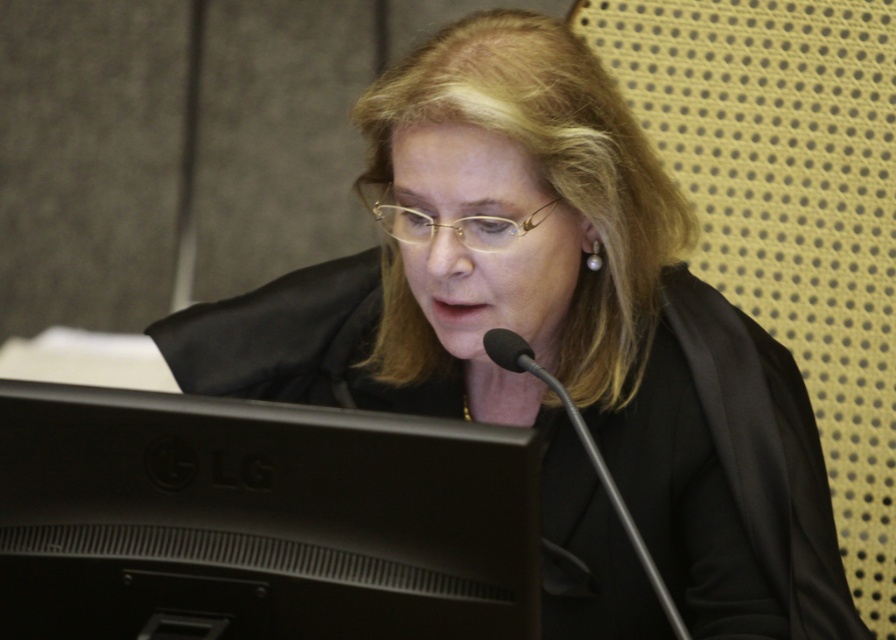
You are a legal assistant in a courtroom. You need to place a document on the desk between the black matte monitor at lower center and the black metallic microphone at center. Which object should you place it closer to if you want it to be nearer to the viewer?

You should place the document closer to the black matte monitor at lower center because it is nearer to the viewer than the black metallic microphone at center.